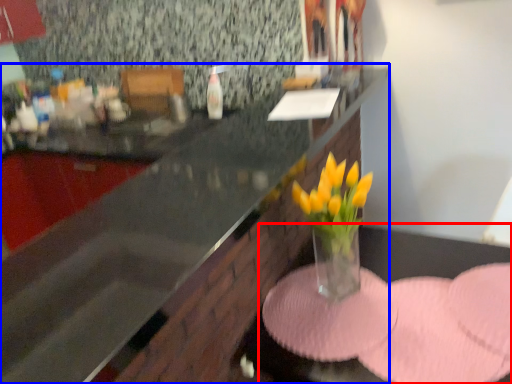
Question: Which point is closer to the camera, table (highlighted by a red box) or countertop (highlighted by a blue box)?

Choices:
 (A) table
 (B) countertop

Answer: (B)